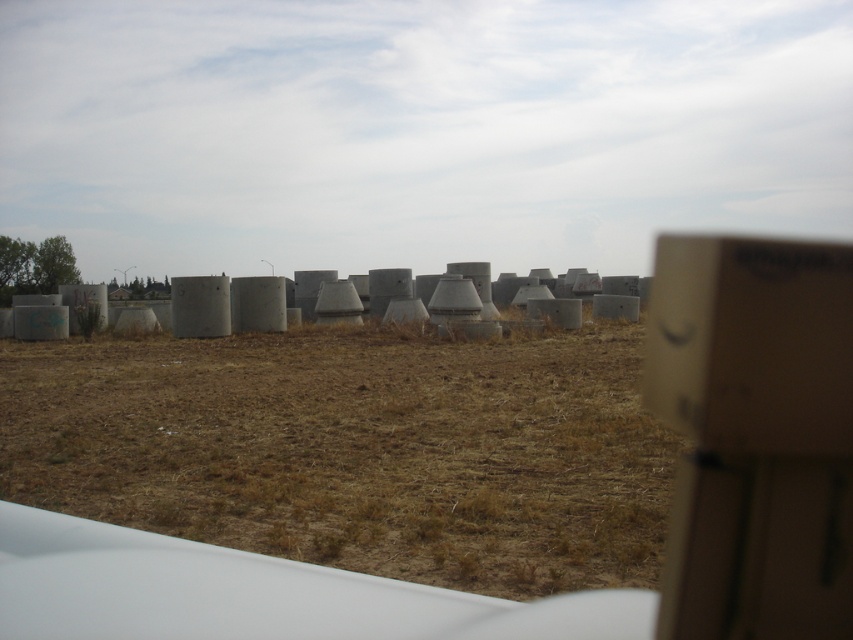
Looking at this image, you are standing at the point labeled as point (x=357, y=449) in the image. What is the immediate terrain beneath your feet?

The immediate terrain beneath your feet is brown dry grass at center.

You are standing in the open field and want to place a new decorative item. If you want to ensure the cardboard box at right is not visible from the front view, where should you position it relative to the brown dry grass at center?

The cardboard box at right is already positioned behind the brown dry grass at center, so it is not visible from the front view.